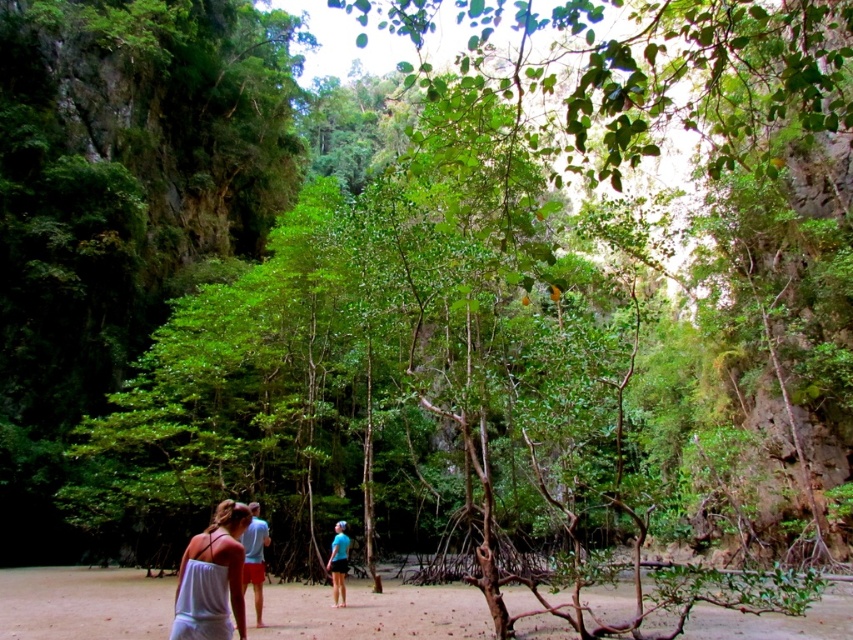
Is light blue fabric shorts at center shorter than blue fabric shirt at center?

No, light blue fabric shorts at center is not shorter than blue fabric shirt at center.

Which is behind, point (251, 500) or point (331, 580)?

Point (251, 500)

What are the coordinates of `light blue fabric shorts at center` in the screenshot? It's located at (254, 557).

Does white fabric tank top at lower left appear over blue fabric shirt at center?

Yes.

Is point (230, 577) less distant than point (335, 600)?

Yes, it is.

Who is more distant from viewer, (207, 540) or (343, 547)?

The point (343, 547) is behind.

I want to click on white fabric tank top at lower left, so click(212, 579).

Does brown sandy dirt at lower center appear over blue fabric shirt at center?

No.

Is point (32, 579) positioned in front of point (329, 561)?

No, (32, 579) is further to viewer.

Which is behind, point (469, 621) or point (334, 573)?

The point (334, 573) is behind.

In order to click on brown sandy dirt at lower center in this screenshot , I will do `click(370, 612)`.